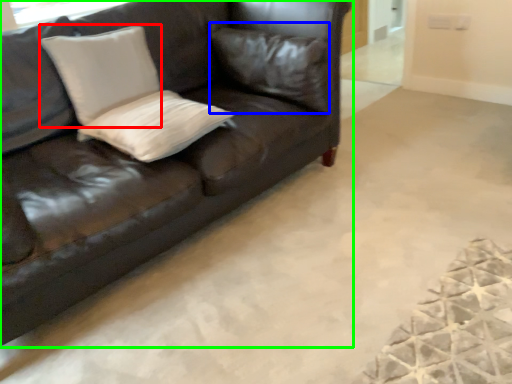
Question: Based on their relative distances, which object is farther from pillow (highlighted by a red box)? Choose from pillow (highlighted by a blue box) and studio couch (highlighted by a green box).

Choices:
 (A) pillow
 (B) studio couch

Answer: (A)